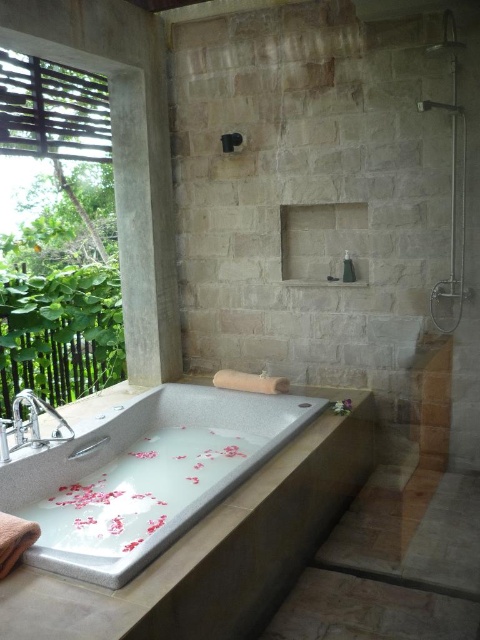
Which is more to the right, white marble bathtub at center or matte gray showerhead at upper right?

From the viewer's perspective, matte gray showerhead at upper right appears more on the right side.

Which is in front, point (249, 449) or point (419, 108)?

Point (419, 108)

Locate an element on the screen. white marble bathtub at center is located at coordinates (144, 474).

Locate an element on the screen. The height and width of the screenshot is (640, 480). matte gray showerhead at upper right is located at coordinates (439, 106).

Describe the element at coordinates (439, 106) in the screenshot. This screenshot has height=640, width=480. I see `matte gray showerhead at upper right` at that location.

Is point (443, 108) in front of point (220, 138)?

Yes, it is in front of point (220, 138).

Identify the location of matte gray showerhead at upper right. The width and height of the screenshot is (480, 640). (439, 106).

Is white marble bathtub at center shorter than black rubber showerhead at upper center?

In fact, white marble bathtub at center may be taller than black rubber showerhead at upper center.

Who is more distant from viewer, (x=233, y=474) or (x=233, y=136)?

Positioned behind is point (x=233, y=136).

Who is more distant from viewer, (171, 516) or (229, 150)?

The point (229, 150) is more distant.

The height and width of the screenshot is (640, 480). I want to click on white marble bathtub at center, so click(144, 474).